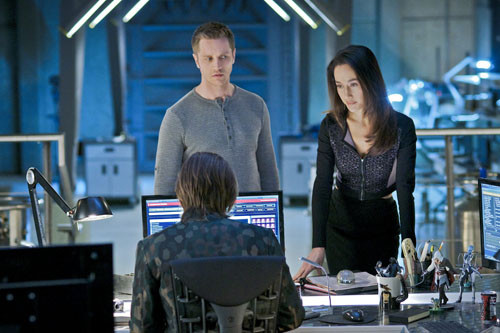
Where is `small cabinet with three drawers/doors`? The image size is (500, 333). small cabinet with three drawers/doors is located at coordinates (124, 163), (304, 152).